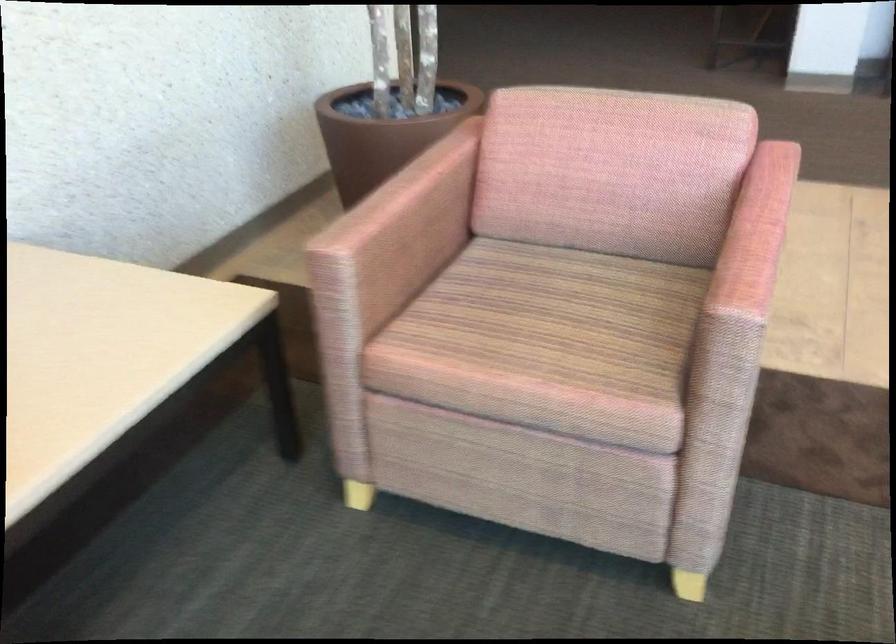
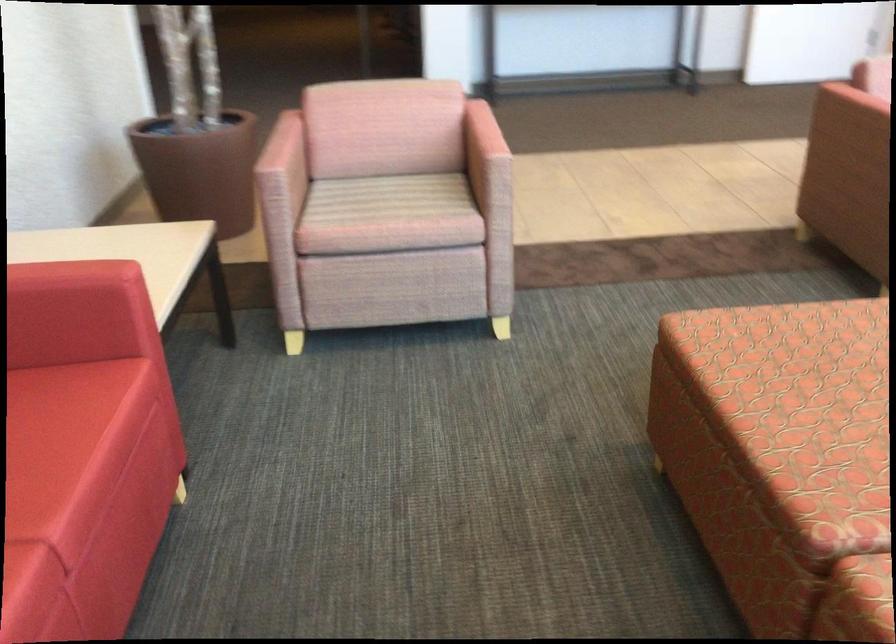
Locate, in the second image, the point that corresponds to [545,316] in the first image.

(389, 198)